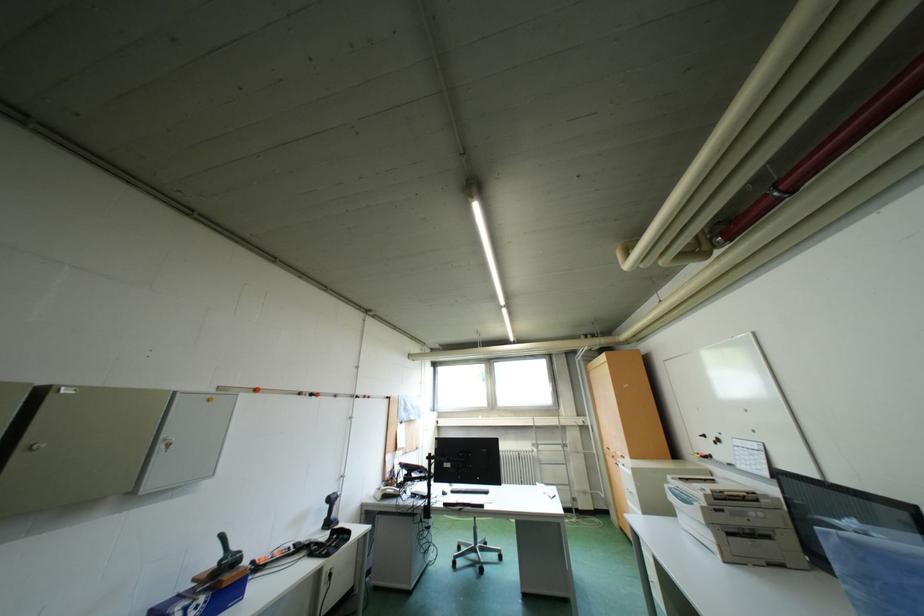
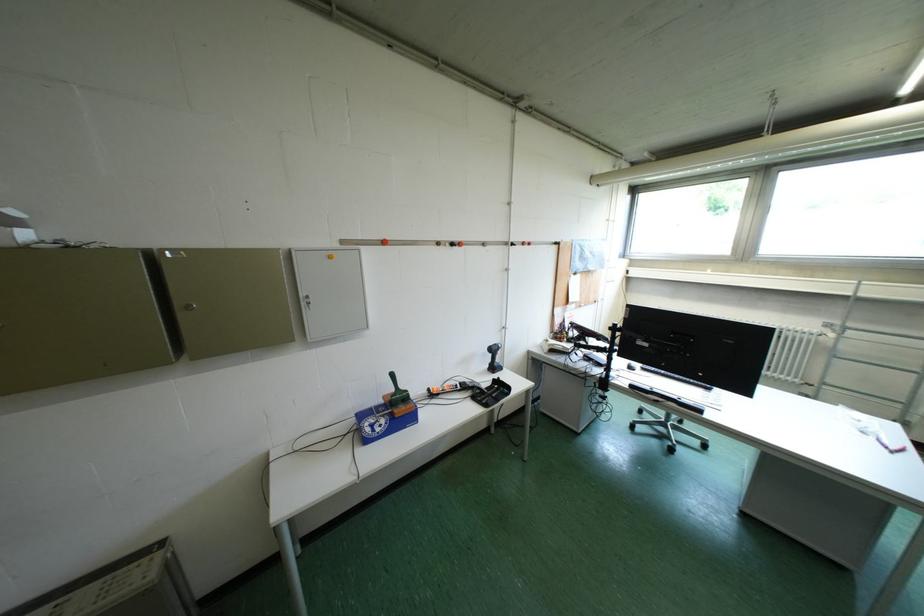
The images are taken continuously from a first-person perspective. In which direction is your viewpoint rotating?

The rotation direction of the camera is left-down.